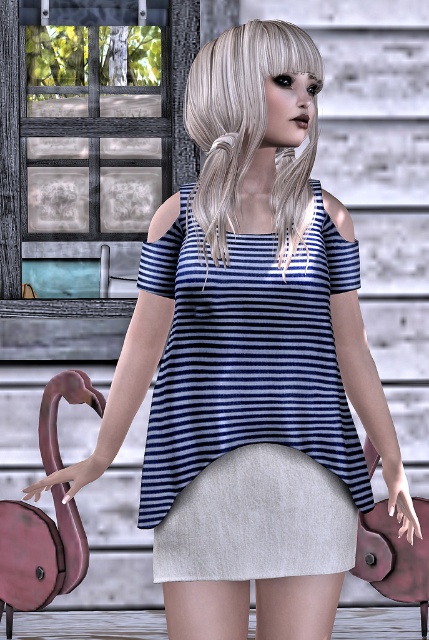
You are a fashion stylist assisting a client who wants to wear both the blue striped fabric dress at center and the light gray cotton pencil skirt at center. Can they wear both items together in the same outfit?

The blue striped fabric dress at center is in front of the light gray cotton pencil skirt at center, so they can be worn together as the dress would naturally overlap the skirt in the outfit.

You are a photographer setting up for a photoshoot. The subject is wearing a blue striped fabric dress at center. You need to position yourself exactly 3 meters away from the dress to achieve the desired depth of field. Is your current position correct based on the scene?

The blue striped fabric dress at center is 3.25 meters away from the camera, which is slightly further than the required 3 meters. To achieve the desired depth of field, you should move 0.25 meters closer to the dress.

You are a fashion stylist helping a client choose between two outfits. The client is looking at the blue striped fabric dress at center and the light gray cotton pencil skirt at center. Which outfit is positioned to the right side of the other?

The blue striped fabric dress at center is positioned on the right side of light gray cotton pencil skirt at center.